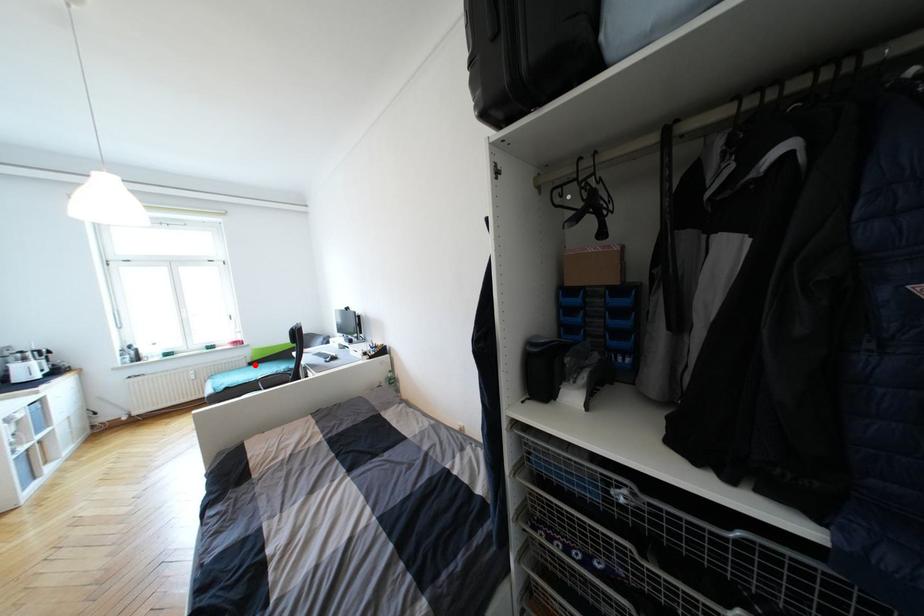
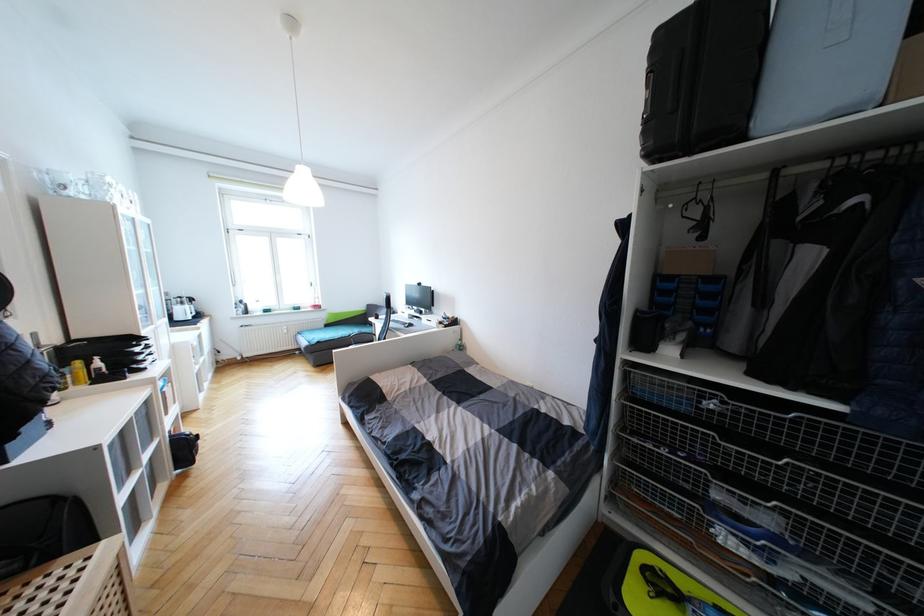
In the second image, find the point that corresponds to the highlighted location in the first image.

(331, 326)